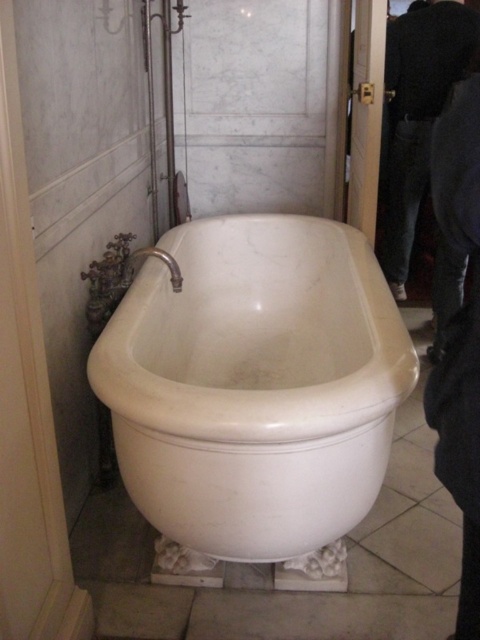
Question: Does white marble bathtub at center lie behind dark gray jeans at right?

Choices:
 (A) no
 (B) yes

Answer: (A)

Question: Which point is farther from the camera taking this photo?

Choices:
 (A) (141, 461)
 (B) (407, 125)

Answer: (B)

Question: Is white marble bathtub at center above dark gray jeans at right?

Choices:
 (A) no
 (B) yes

Answer: (A)

Question: Does white marble bathtub at center have a smaller size compared to dark gray jeans at right?

Choices:
 (A) yes
 (B) no

Answer: (B)